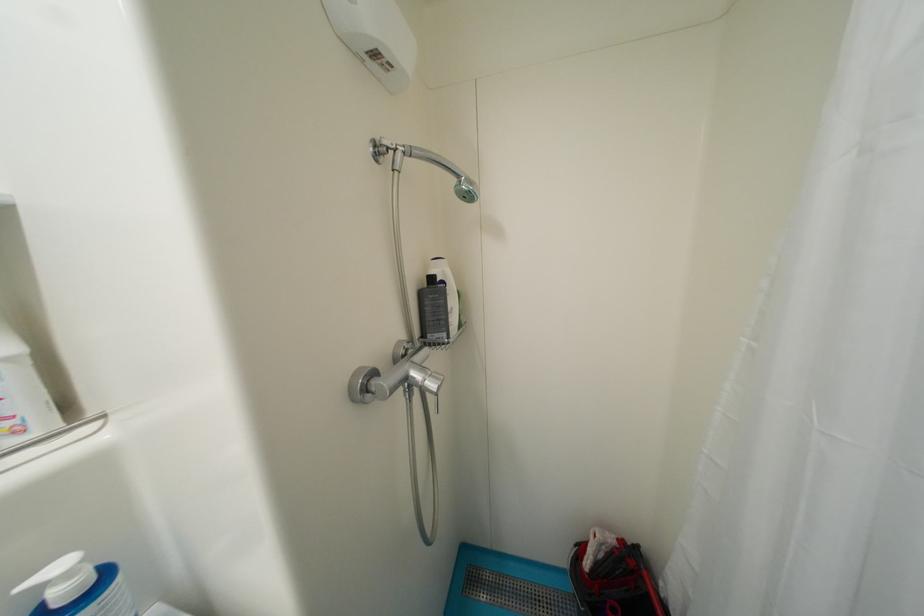
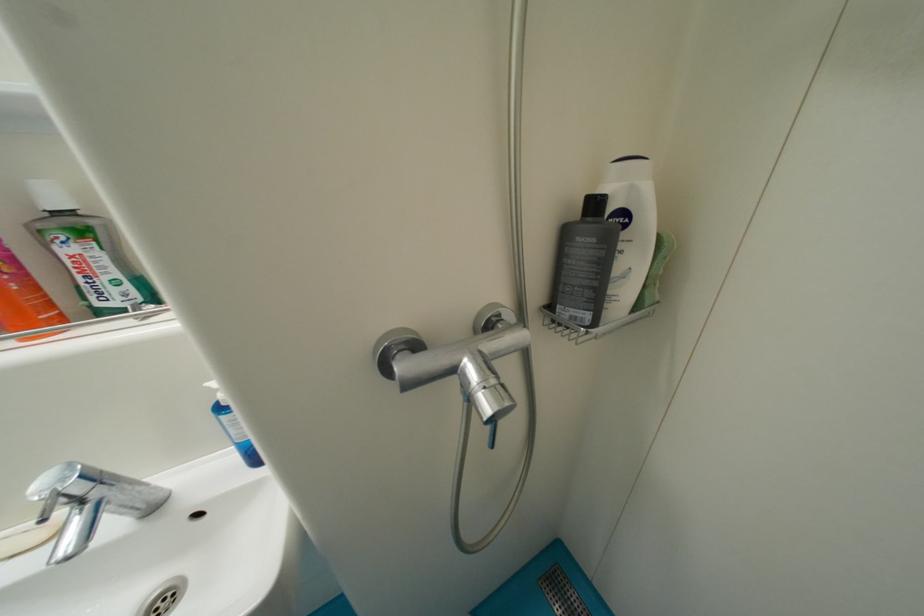
How did the camera likely rotate?

The rotation direction of the camera is left-down.